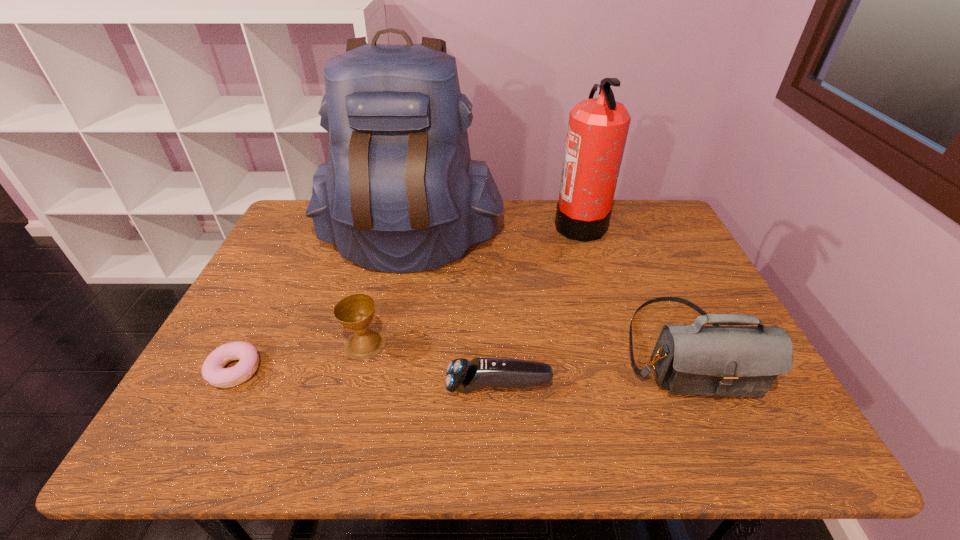
Find the location of `vacant space located 0.230m on the left of the shoulder bag`. vacant space located 0.230m on the left of the shoulder bag is located at coordinates (527, 348).

What are the coordinates of `free spot located on the right of the fourth tallest object` in the screenshot? It's located at (540, 343).

This screenshot has height=540, width=960. What are the coordinates of `free space located on the head of the fifth tallest object` in the screenshot? It's located at (309, 386).

At what (x,y) coordinates should I click in order to perform the action: click on free region located 0.130m on the head of the fifth tallest object. Please return your answer as a coordinate pair (x, y). Looking at the image, I should click on 387,386.

This screenshot has height=540, width=960. I want to click on free location located on the head of the fifth tallest object, so click(336, 386).

I want to click on vacant region located on the back of the doughnut, so click(277, 288).

This screenshot has width=960, height=540. In order to click on backpack that is at the far edge in this screenshot , I will do [399, 193].

The width and height of the screenshot is (960, 540). Find the location of `fire extinguisher that is positioned at the far edge`. fire extinguisher that is positioned at the far edge is located at coordinates (597, 131).

At what (x,y) coordinates should I click in order to perform the action: click on backpack located in the left edge section of the desktop. Please return your answer as a coordinate pair (x, y). Looking at the image, I should click on coord(399,193).

Where is `doughnut that is at the left edge`? The image size is (960, 540). doughnut that is at the left edge is located at coordinates pos(213,371).